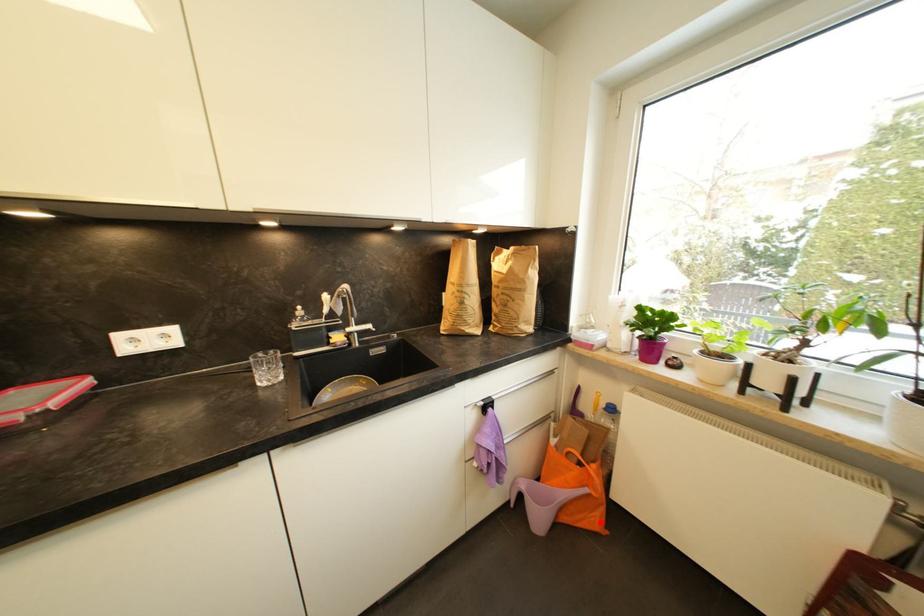
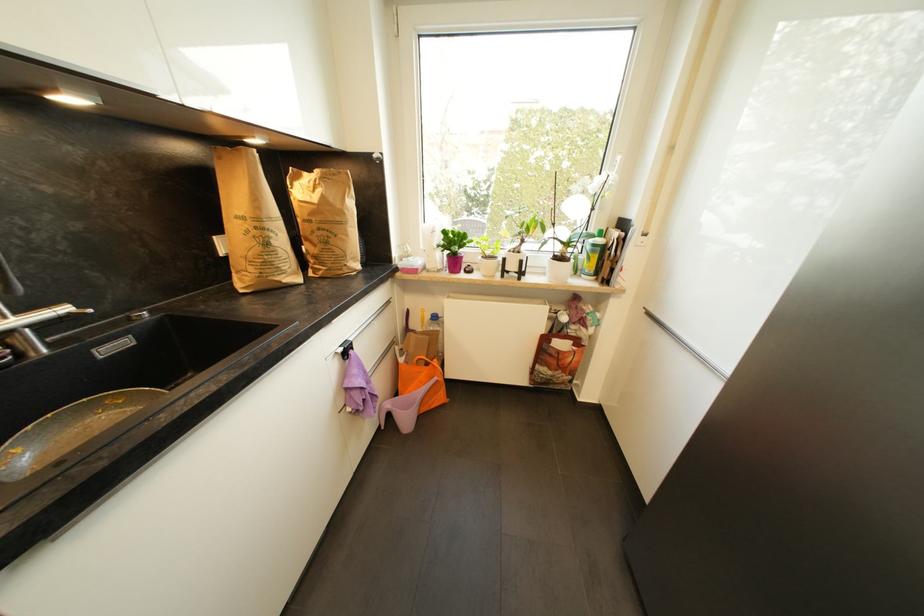
Locate, in the second image, the point that corresponds to the highlighted location in the first image.

(445, 399)